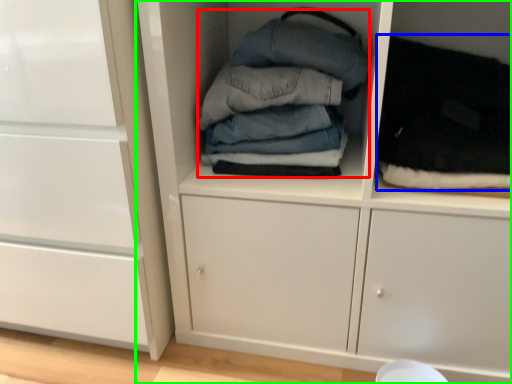
Question: Which object is positioned farthest from clothing (highlighted by a red box)? Select from clothing (highlighted by a blue box) and cupboard (highlighted by a green box).

Choices:
 (A) clothing
 (B) cupboard

Answer: (A)